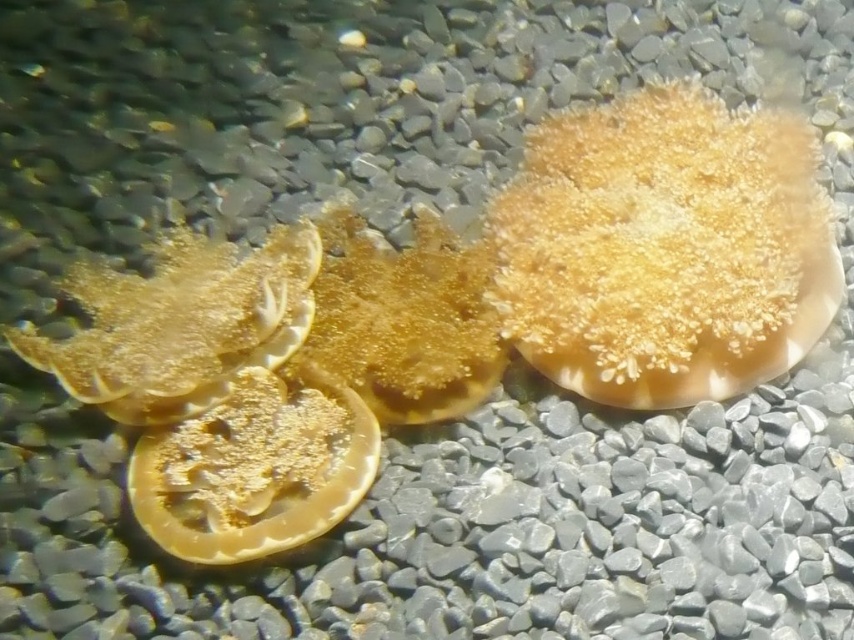
Question: Is golden textured scallop at center positioned in front of translucent yellow scallop at center?

Choices:
 (A) no
 (B) yes

Answer: (A)

Question: Among these points, which one is nearest to the camera?

Choices:
 (A) (164, 506)
 (B) (654, 401)

Answer: (A)

Question: Which point is farther to the camera?

Choices:
 (A) translucent yellow scallop at center
 (B) golden textured scallop at center

Answer: (B)

Question: Does golden textured scallop at center appear on the right side of translucent yellow scallop at center?

Choices:
 (A) yes
 (B) no

Answer: (A)

Question: Is the position of golden textured scallop at center more distant than that of translucent yellow scallop at center?

Choices:
 (A) yes
 (B) no

Answer: (A)